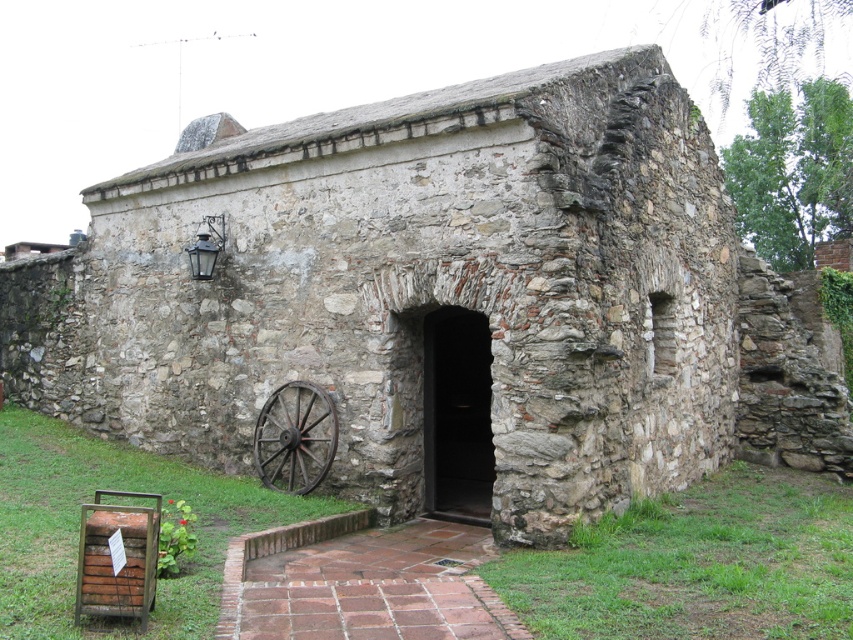
Question: Which point is farther to the camera?

Choices:
 (A) rusty metal wagon wheel at lower left
 (B) rustic stone fort at center
 (C) dark stone door at center

Answer: (A)

Question: Is dark stone door at center to the right of rusty metal wagon wheel at lower left from the viewer's perspective?

Choices:
 (A) yes
 (B) no

Answer: (A)

Question: Which of the following is the closest to the observer?

Choices:
 (A) dark stone door at center
 (B) rusty metal wagon wheel at lower left
 (C) rustic stone fort at center

Answer: (C)

Question: Considering the relative positions of dark stone door at center and rusty metal wagon wheel at lower left in the image provided, where is dark stone door at center located with respect to rusty metal wagon wheel at lower left?

Choices:
 (A) left
 (B) right

Answer: (B)

Question: Does rustic stone fort at center appear over dark stone door at center?

Choices:
 (A) no
 (B) yes

Answer: (B)

Question: Which of the following is the farthest from the observer?

Choices:
 (A) click(271, 449)
 (B) click(96, 186)

Answer: (B)